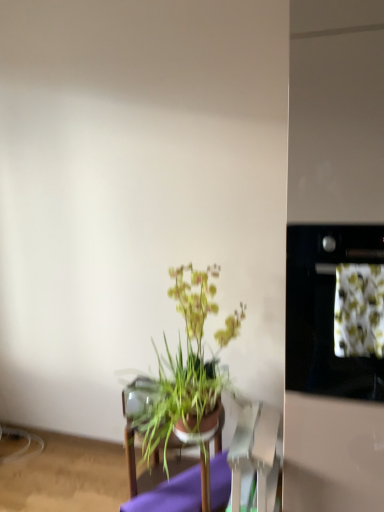
The width and height of the screenshot is (384, 512). Describe the element at coordinates (359, 310) in the screenshot. I see `green leafy plant at center` at that location.

In order to face green leafy plant at center, should I rotate leftwards or rightwards?

To face it directly, rotate right by 22.145 degrees.

In order to face green leafy plant at center, should I rotate leftwards or rightwards?

A 2.268 degree turn to the left will do.

Find the location of a particular element. green leafy plant at center is located at coordinates (359, 310).

Does green leafy plant at center appear on the right side of green leafy plant at center?

Yes, green leafy plant at center is to the right of green leafy plant at center.

Which is behind, point (342, 334) or point (200, 309)?

Point (200, 309)

Is the depth of green leafy plant at center less than that of green leafy plant at center?

Yes, it is in front of green leafy plant at center.

Based on their sizes in the image, would you say green leafy plant at center is bigger or smaller than green leafy plant at center?

Clearly, green leafy plant at center is smaller in size than green leafy plant at center.

Is green leafy plant at center not close to green leafy plant at center?

green leafy plant at center is near green leafy plant at center, not far away.

Considering the sizes of green leafy plant at center and green leafy plant at center in the image, is green leafy plant at center taller or shorter than green leafy plant at center?

Clearly, green leafy plant at center is shorter compared to green leafy plant at center.

Which is nearer, (361, 264) or (219, 474)?

Positioned in front is point (361, 264).

From a real-world perspective, is green leafy plant at center above or below green leafy plant at center?

Clearly, from a real-world perspective, green leafy plant at center is above green leafy plant at center.

In the image, is stainless steel oven at right positioned in front of or behind green leafy plant at center?

Visually, stainless steel oven at right is located in front of green leafy plant at center.

From the image's perspective, does stainless steel oven at right appear higher than green leafy plant at center?

Yes, from the image's perspective, stainless steel oven at right is on top of green leafy plant at center.

Which is more to the right, stainless steel oven at right or green leafy plant at center?

stainless steel oven at right.

How much distance is there between stainless steel oven at right and green leafy plant at center?

stainless steel oven at right and green leafy plant at center are 22.16 inches apart.

From the image's perspective, relative to green leafy plant at center, is stainless steel oven at right above or below?

stainless steel oven at right is above green leafy plant at center.

Which object is wider, stainless steel oven at right or green leafy plant at center?

Wider between the two is stainless steel oven at right.

Is stainless steel oven at right taller or shorter than green leafy plant at center?

In the image, stainless steel oven at right appears to be taller than green leafy plant at center.

Consider the image. From a real-world perspective, relative to green leafy plant at center, is stainless steel oven at right vertically above or below?

Clearly, from a real-world perspective, stainless steel oven at right is above green leafy plant at center.

Would you say green leafy plant at center is to the left or to the right of green leafy plant at center in the picture?

Clearly, green leafy plant at center is on the left of green leafy plant at center in the image.

Is point (160, 406) behind point (378, 280)?

Yes, point (160, 406) is farther from viewer.

Identify the location of flower on the right of green leafy plant at center. The height and width of the screenshot is (512, 384). (359, 310).

Can you tell me how much green leafy plant at center and green leafy plant at center differ in facing direction?

There is a 0.476-degree angle between the facing directions of green leafy plant at center and green leafy plant at center.

Can you confirm if green leafy plant at center is smaller than stainless steel oven at right?

Yes.

From a real-world perspective, who is located higher, green leafy plant at center or stainless steel oven at right?

green leafy plant at center.

Is green leafy plant at center inside or outside of stainless steel oven at right?

green leafy plant at center is contained in stainless steel oven at right.

Does green leafy plant at center have a lesser width compared to stainless steel oven at right?

Correct, the width of green leafy plant at center is less than that of stainless steel oven at right.

Can you confirm if stainless steel oven at right is taller than green leafy plant at center?

Yes, stainless steel oven at right is taller than green leafy plant at center.

Which is in front, stainless steel oven at right or green leafy plant at center?

green leafy plant at center.

Considering the positions of point (287, 330) and point (346, 273), is point (287, 330) closer or farther from the camera than point (346, 273)?

Point (287, 330) is positioned farther from the camera compared to point (346, 273).

Locate an element on the screen. This screenshot has width=384, height=512. houseplant on the left of green leafy plant at center is located at coordinates (187, 365).

At what (x,y) coordinates should I click in order to perform the action: click on flower above the green leafy plant at center (from a real-world perspective). Please return your answer as a coordinate pair (x, y). The height and width of the screenshot is (512, 384). Looking at the image, I should click on (359, 310).

Which object lies nearer to the anchor point green leafy plant at center, green leafy plant at center or green leafy plant at center?

green leafy plant at center.

In the scene shown: Looking at the image, which one is located further to green leafy plant at center, stainless steel oven at right or green leafy plant at center?

Among the two, green leafy plant at center is located further to green leafy plant at center.

From the image, which object appears to be nearer to green leafy plant at center, green leafy plant at center or green leafy plant at center?

The object closer to green leafy plant at center is green leafy plant at center.

From the image, which object appears to be farther from green leafy plant at center, green leafy plant at center or green leafy plant at center?

Based on the image, green leafy plant at center appears to be further to green leafy plant at center.

Estimate the real-world distances between objects in this image. Which object is closer to stainless steel oven at right, green leafy plant at center or green leafy plant at center?

green leafy plant at center.

Estimate the real-world distances between objects in this image. Which object is closer to green leafy plant at center, stainless steel oven at right or green leafy plant at center?

Based on the image, green leafy plant at center appears to be nearer to green leafy plant at center.

Based on their spatial positions, is green leafy plant at center or green leafy plant at center closer to green leafy plant at center?

green leafy plant at center is closer to green leafy plant at center.

When comparing their distances from green leafy plant at center, does stainless steel oven at right or green leafy plant at center seem further?

Based on the image, green leafy plant at center appears to be further to green leafy plant at center.

Identify the location of houseplant between stainless steel oven at right and green leafy plant at center in the vertical direction. (187, 365).

The width and height of the screenshot is (384, 512). I want to click on flower between green leafy plant at center and stainless steel oven at right in the horizontal direction, so click(x=359, y=310).

What are the coordinates of `houseplant between green leafy plant at center and green leafy plant at center vertically` in the screenshot? It's located at (187, 365).

You are a GUI agent. You are given a task and a screenshot of the screen. Output one action in this format:
    pyautogui.click(x=<x>, y=<y>)
    Task: Click on the flower between stainless steel oven at right and green leafy plant at center in the vertical direction
    
    Given the screenshot: What is the action you would take?
    pyautogui.click(x=359, y=310)